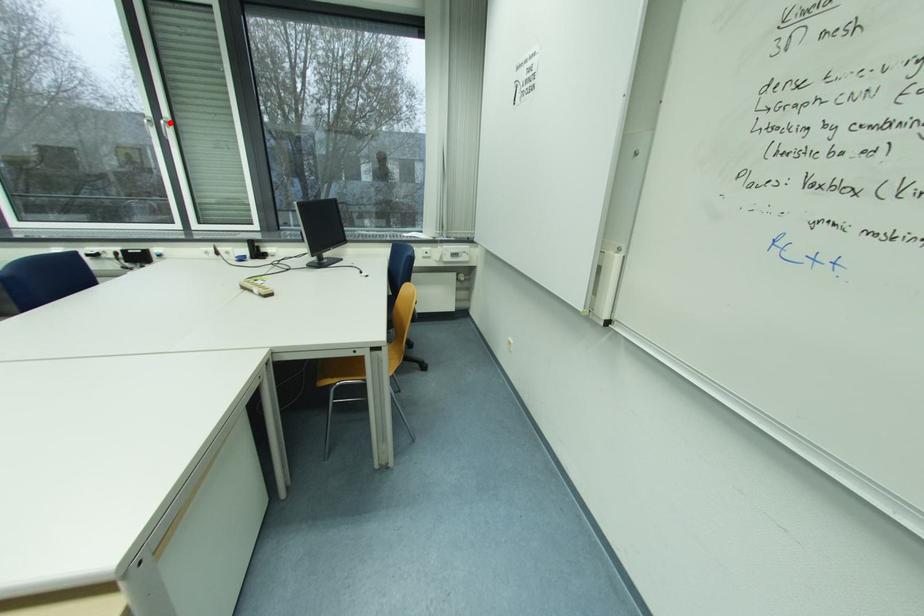
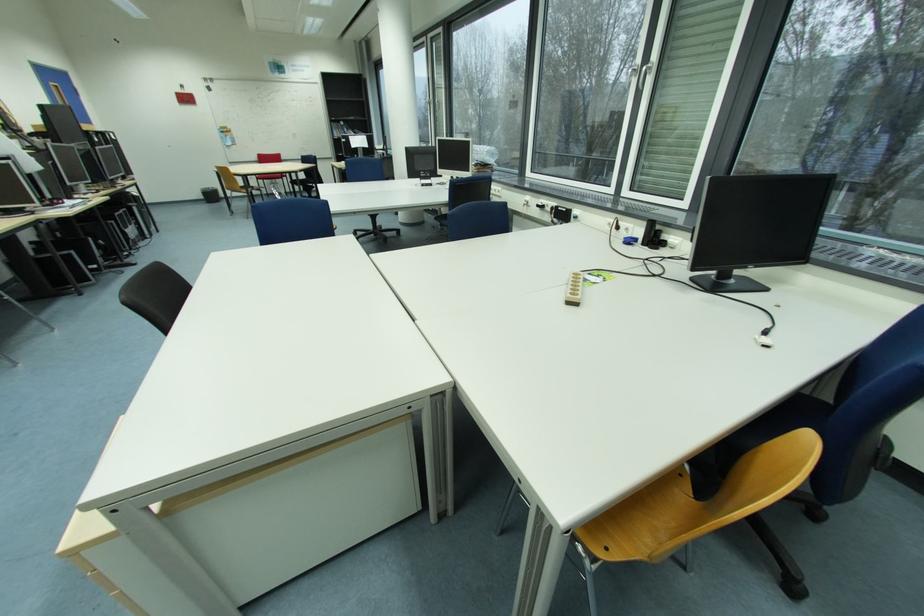
Question: A red point is marked in image1. In image2, is the corresponding 3D point closer to the camera or farther? Reply with the corresponding letter.

Choices:
 (A) The corresponding 3D point is closer.
 (B) The corresponding 3D point is farther.

Answer: (A)